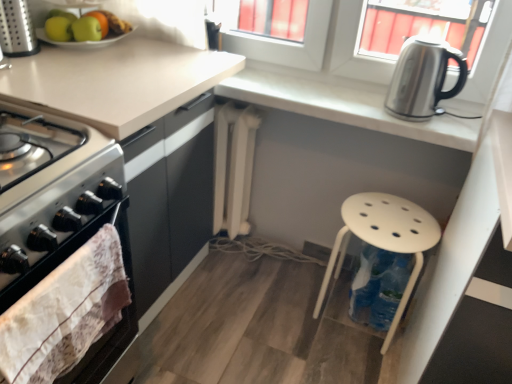
I want to click on vacant point to the left of satin silver kettle at upper right, so click(351, 96).